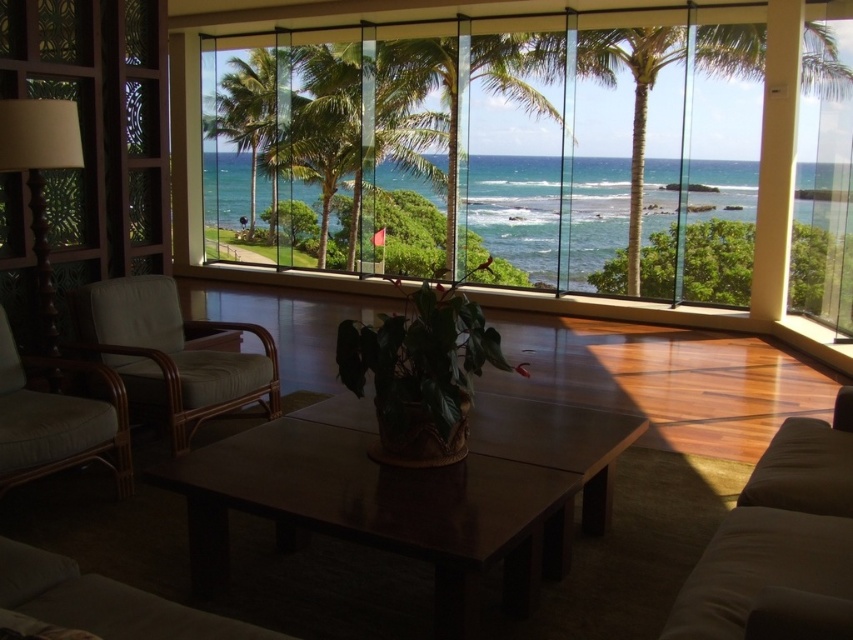
You are sitting in the light beige woven armchair at left and want to look at the green leafy palm tree at right. Which direction should you turn your head to see it?

The light beige woven armchair at left is positioned on the left side of the green leafy palm tree at right, so you should turn your head to the right to see it.